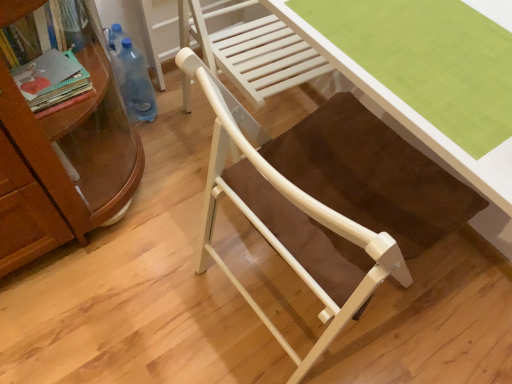
Find the location of a particular element. This screenshot has width=512, height=384. free location in front of blue plastic bottle at left is located at coordinates (159, 147).